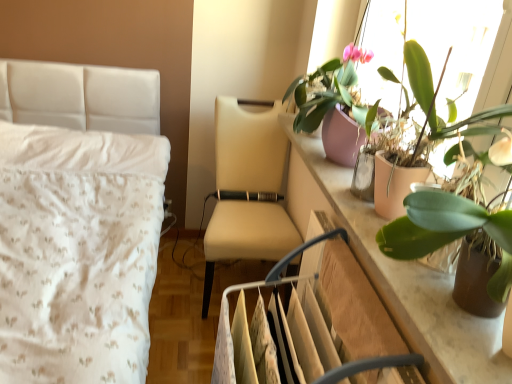
Question: Considering the relative sizes of beige leather swivel chair at center and pink matte pot at upper right, the first houseplant in the back-to-front sequence, in the image provided, is beige leather swivel chair at center bigger than pink matte pot at upper right, the first houseplant in the back-to-front sequence,?

Choices:
 (A) no
 (B) yes

Answer: (B)

Question: Is beige leather swivel chair at center facing away from pink matte pot at upper right, which is counted as the 3th houseplant, starting from the front?

Choices:
 (A) yes
 (B) no

Answer: (B)

Question: From the image's perspective, is beige leather swivel chair at center under pink matte pot at upper right, the first houseplant in the back-to-front sequence?

Choices:
 (A) yes
 (B) no

Answer: (A)

Question: From a real-world perspective, is beige leather swivel chair at center located beneath pink matte pot at upper right, the first houseplant in the back-to-front sequence?

Choices:
 (A) yes
 (B) no

Answer: (A)

Question: Does beige leather swivel chair at center turn towards pink matte pot at upper right, which is counted as the 3th houseplant, starting from the front?

Choices:
 (A) no
 (B) yes

Answer: (A)

Question: Does beige leather swivel chair at center have a smaller size compared to pink matte pot at upper right, which is counted as the 3th houseplant, starting from the front?

Choices:
 (A) yes
 (B) no

Answer: (B)

Question: Does pink matte pot at upper right, which is counted as the 3th houseplant, starting from the front, have a greater height compared to green matte leafy plant at upper right, the second houseplant viewed from the back?

Choices:
 (A) no
 (B) yes

Answer: (B)

Question: Is pink matte pot at upper right, the first houseplant in the back-to-front sequence, thinner than green matte leafy plant at upper right, the second houseplant viewed from the back?

Choices:
 (A) yes
 (B) no

Answer: (B)

Question: Is pink matte pot at upper right, which is counted as the 3th houseplant, starting from the front, far from green matte leafy plant at upper right, the second houseplant viewed from the back?

Choices:
 (A) no
 (B) yes

Answer: (A)

Question: Would you say pink matte pot at upper right, which is counted as the 3th houseplant, starting from the front, contains green matte leafy plant at upper right, acting as the second houseplant starting from the front?

Choices:
 (A) yes
 (B) no

Answer: (B)

Question: Is pink matte pot at upper right, which is counted as the 3th houseplant, starting from the front, wider than green matte leafy plant at upper right, the second houseplant viewed from the back?

Choices:
 (A) no
 (B) yes

Answer: (B)

Question: Is pink matte pot at upper right, the first houseplant in the back-to-front sequence, oriented away from green matte leafy plant at upper right, the second houseplant viewed from the back?

Choices:
 (A) yes
 (B) no

Answer: (B)

Question: Considering the relative sizes of beige fabric chair at center and green matte plant at upper right, arranged as the first houseplant when viewed from the front, in the image provided, is beige fabric chair at center bigger than green matte plant at upper right, arranged as the first houseplant when viewed from the front,?

Choices:
 (A) yes
 (B) no

Answer: (A)